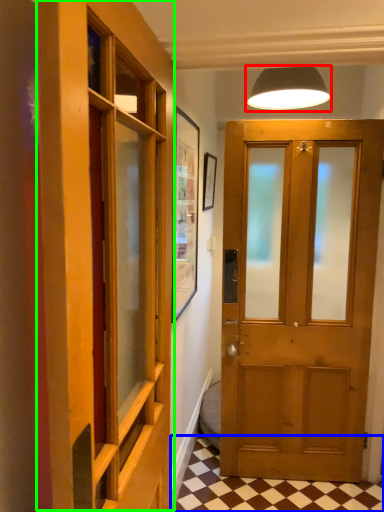
Question: Considering the real-world distances, which object is farthest from lamp (highlighted by a red box)? tile (highlighted by a blue box) or elevator (highlighted by a green box)?

Choices:
 (A) tile
 (B) elevator

Answer: (A)